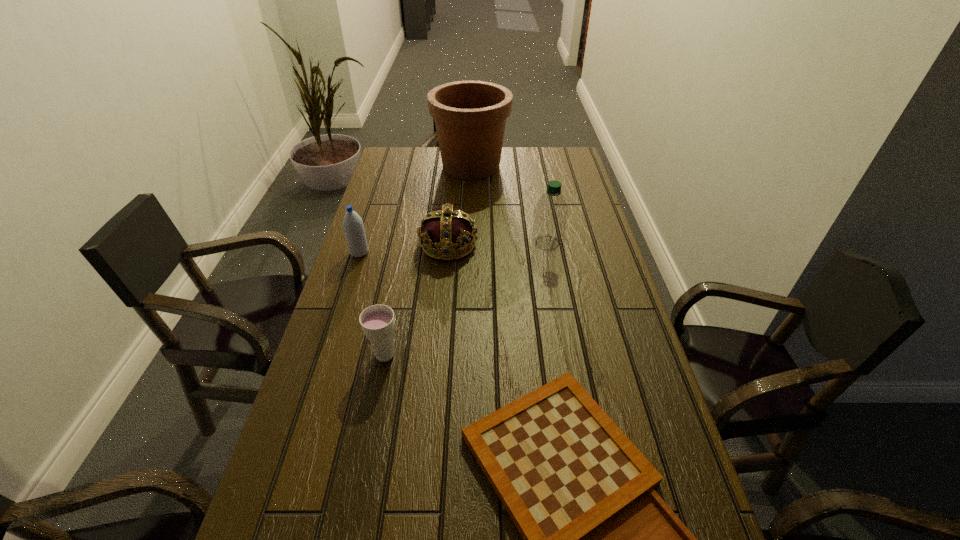
This screenshot has width=960, height=540. Identify the location of free spot that satisfies the following two spatial constraints: 1. on the back side of the crown; 2. on the left side of the farthest object. (455, 166).